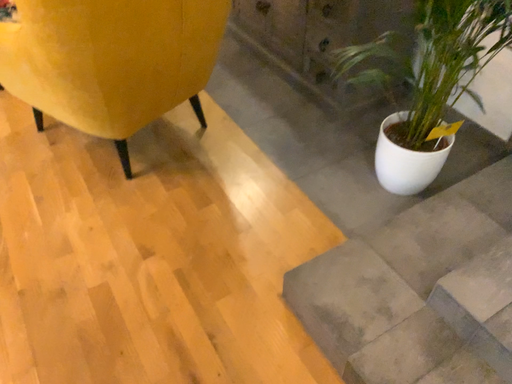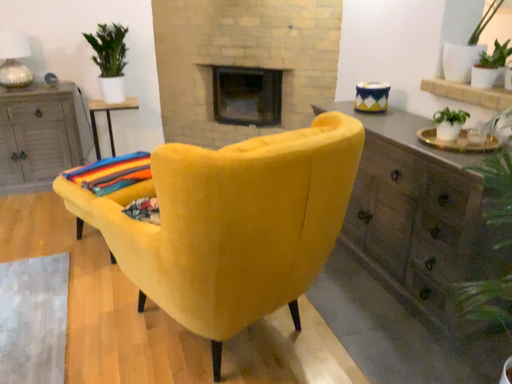
Question: Which way did the camera rotate in the video?

Choices:
 (A) rotated left
 (B) rotated right

Answer: (A)